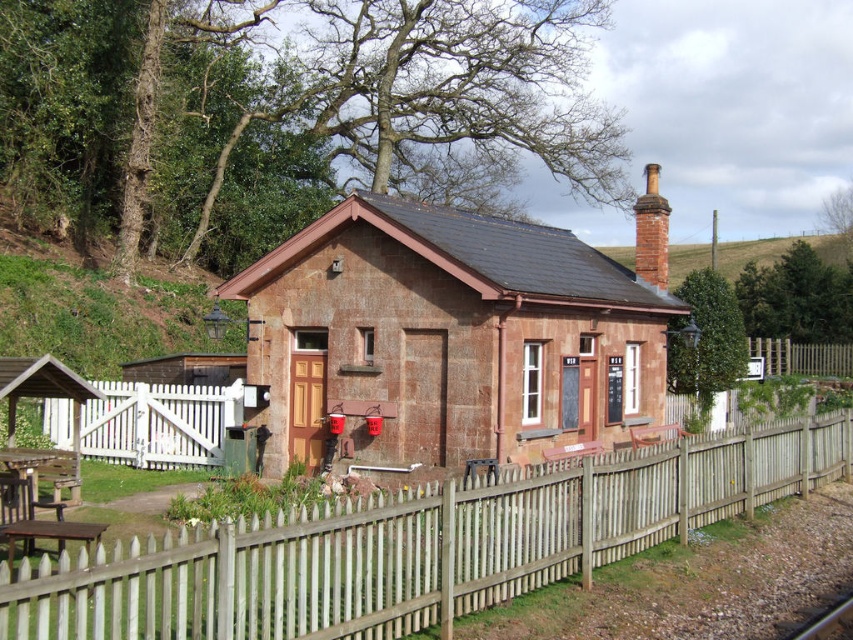
You are a painter planning to paint the rustic stone hut at center and the red brick chimney at upper right. If you want to use more paint for the wider object, which one should you allocate more paint to?

The red brick chimney at upper right is wider than the rustic stone hut at center, so you should allocate more paint to the red brick chimney at upper right.

You are a visitor approaching the quaint brick building and notice two fences. The wooden picket fence at center and the brown wooden fence at right. Which fence do you think is taller?

The wooden picket fence at center is not as tall as the brown wooden fence at right, so the brown wooden fence at right is taller.